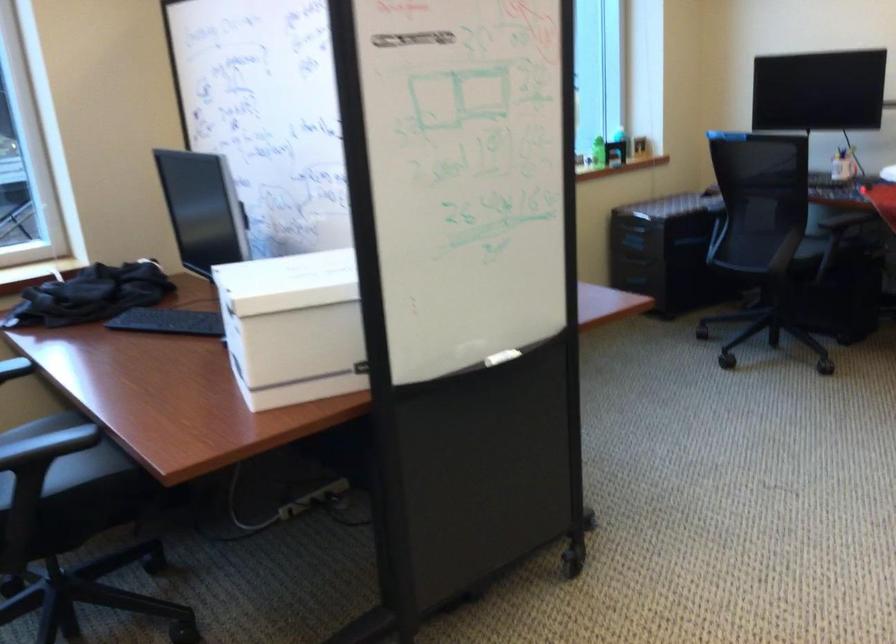
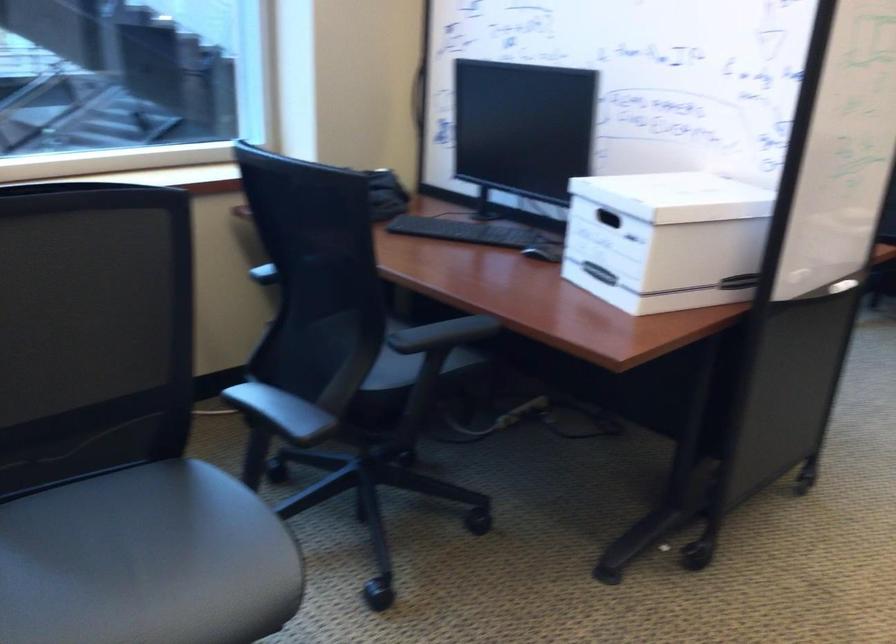
Question: I am providing you with two images of the same scene from different viewpoints. Please identify which objects are invisible in image2.

Choices:
 (A) grey plant pot
 (B) black chair sitting surface
 (C) green plastic bottle
 (D) box handle cutout

Answer: (C)